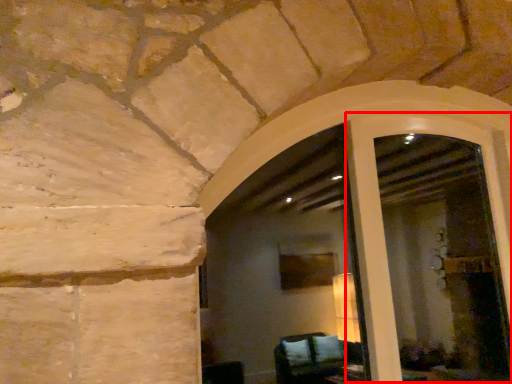
Question: Where is screen door (annotated by the red box) located in relation to window frame in the image?

Choices:
 (A) left
 (B) right

Answer: (B)